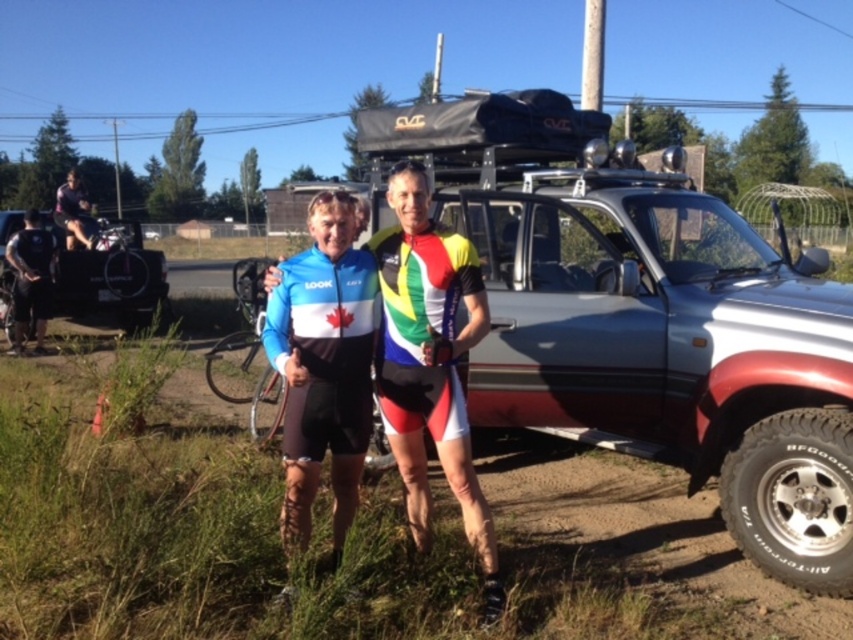
You are a photographer setting up a shot of the silver metallic pickup truck at center and the blue matte cycling jersey at center. Based on their positions, which object should you focus on first to ensure it appears sharp in the foreground?

Answer: The blue matte cycling jersey at center should be focused on first since it is in the foreground, closer to the viewer than the silver metallic pickup truck at center which is positioned behind it.

You are a photographer trying to capture a photo of both individuals in the scene. You notice two points marked in the image. The first point is at coordinate point [657,304] and the second at point [432,422]. Based on their positions, which point is closer to the photographer?

Point [432,422] is closer to the photographer because it is in front of point [657,304], which is behind it.

You are a delivery driver who needs to park your truck in the same spot as the silver metallic pickup truck at center. What coordinates should you aim for?

The silver metallic pickup truck at center is positioned at coordinates point (x=642, y=317), so you should aim for those coordinates to park your truck in the same spot.